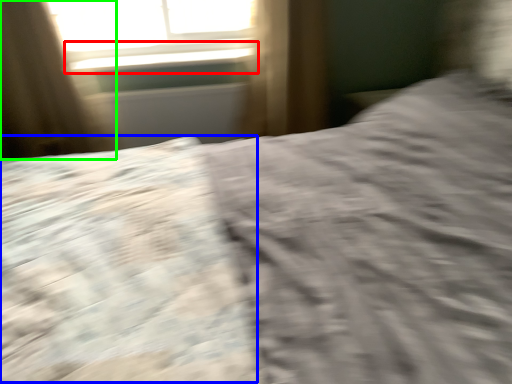
Question: Which object is the closest to the window sill (highlighted by a red box)? Choose among these: sheet (highlighted by a blue box) or curtain (highlighted by a green box).

Choices:
 (A) sheet
 (B) curtain

Answer: (B)